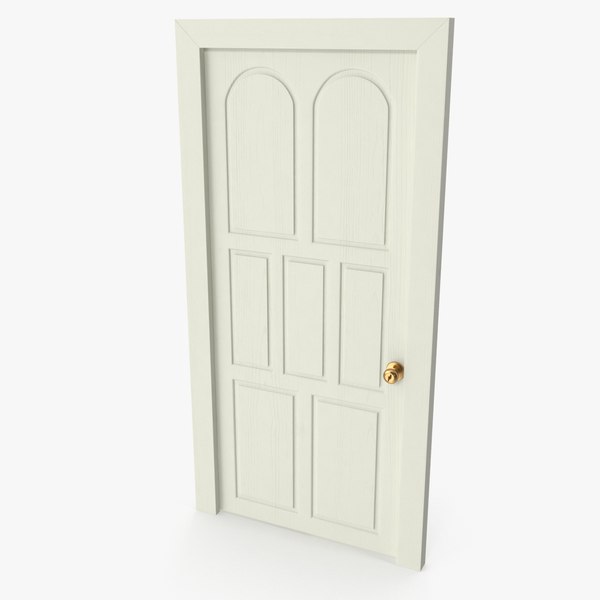
Locate an element on the screen. This screenshot has height=600, width=600. door is located at coordinates (345, 480).